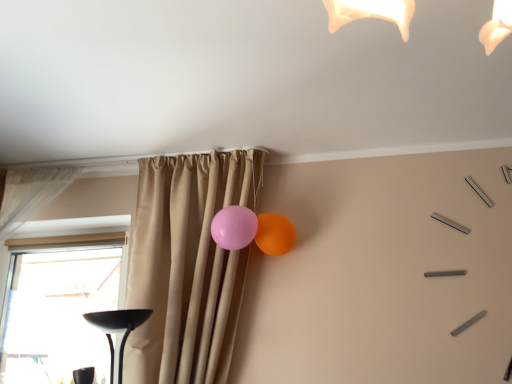
Locate an element on the screen. The image size is (512, 384). beige curtain at center, the second curtain in the left-to-right sequence is located at coordinates (x=186, y=266).

The image size is (512, 384). Describe the element at coordinates (31, 194) in the screenshot. I see `white sheer curtain at left, arranged as the 2th curtain when viewed from the right` at that location.

Describe the element at coordinates (234, 227) in the screenshot. This screenshot has width=512, height=384. I see `pink rubber balloon at center, the 2th balloon positioned from the right` at that location.

Locate an element on the screen. beige curtain at center, the second curtain in the left-to-right sequence is located at coordinates (186, 266).

Considering the relative sizes of transparent glass window at lower left and matte rubber balloon at upper right, which appears as the 2th balloon when viewed from the left, in the image provided, is transparent glass window at lower left bigger than matte rubber balloon at upper right, which appears as the 2th balloon when viewed from the left,?

Correct, transparent glass window at lower left is larger in size than matte rubber balloon at upper right, which appears as the 2th balloon when viewed from the left.

Is transparent glass window at lower left spatially inside matte rubber balloon at upper right, which appears as the 2th balloon when viewed from the left, or outside of it?

transparent glass window at lower left is located beyond the bounds of matte rubber balloon at upper right, which appears as the 2th balloon when viewed from the left.

From the image's perspective, relative to matte rubber balloon at upper right, positioned as the 1th balloon in right-to-left order, is transparent glass window at lower left above or below?

Based on their image positions, transparent glass window at lower left is located beneath matte rubber balloon at upper right, positioned as the 1th balloon in right-to-left order.

Can you confirm if transparent glass window at lower left is wider than matte rubber balloon at upper right, positioned as the 1th balloon in right-to-left order?

No.

Considering the positions of objects beige curtain at center, the second curtain in the left-to-right sequence, and white sheer curtain at left, which is the first curtain in left-to-right order, in the image provided, who is behind, beige curtain at center, the second curtain in the left-to-right sequence, or white sheer curtain at left, which is the first curtain in left-to-right order,?

Positioned behind is white sheer curtain at left, which is the first curtain in left-to-right order.

Considering the points (186, 258) and (62, 188), which point is in front, point (186, 258) or point (62, 188)?

The point (186, 258) is closer to the camera.

Is beige curtain at center, which is the 1th curtain in right-to-left order, aimed at white sheer curtain at left, arranged as the 2th curtain when viewed from the right?

No, beige curtain at center, which is the 1th curtain in right-to-left order, is not turned towards white sheer curtain at left, arranged as the 2th curtain when viewed from the right.

Is beige curtain at center, the second curtain in the left-to-right sequence, taller or shorter than white sheer curtain at left, which is the first curtain in left-to-right order?

Considering their sizes, beige curtain at center, the second curtain in the left-to-right sequence, has more height than white sheer curtain at left, which is the first curtain in left-to-right order.

From the image's perspective, between transparent glass window at lower left and beige curtain at center, which is the 1th curtain in right-to-left order, who is located below?

transparent glass window at lower left.

Can you tell me how much transparent glass window at lower left and beige curtain at center, which is the 1th curtain in right-to-left order, differ in facing direction?

They differ by 3.63 degrees in their facing directions.

Considering the points (65, 262) and (194, 372), which point is behind, point (65, 262) or point (194, 372)?

The point (65, 262) is farther from the camera.

From the picture: Is transparent glass window at lower left facing towards beige curtain at center, which is the 1th curtain in right-to-left order?

No.

Is pink rubber balloon at center, the first balloon when ordered from left to right, looking in the opposite direction of beige curtain at center, the second curtain in the left-to-right sequence?

Yes.

Which object is thinner, pink rubber balloon at center, the first balloon when ordered from left to right, or beige curtain at center, which is the 1th curtain in right-to-left order?

With smaller width is pink rubber balloon at center, the first balloon when ordered from left to right.

At what (x,y) coordinates should I click in order to perform the action: click on the 1st balloon behind the beige curtain at center, which is the 1th curtain in right-to-left order, starting your count from the anchor. Please return your answer as a coordinate pair (x, y). This screenshot has height=384, width=512. Looking at the image, I should click on (234, 227).

From the image's perspective, who appears lower, pink rubber balloon at center, the first balloon when ordered from left to right, or beige curtain at center, which is the 1th curtain in right-to-left order?

beige curtain at center, which is the 1th curtain in right-to-left order, from the image's perspective.

From a real-world perspective, is matte rubber balloon at upper right, which appears as the 2th balloon when viewed from the left, positioned under beige curtain at center, the second curtain in the left-to-right sequence, based on gravity?

No.

Is matte rubber balloon at upper right, positioned as the 1th balloon in right-to-left order, completely or partially outside of beige curtain at center, the second curtain in the left-to-right sequence?

No, matte rubber balloon at upper right, positioned as the 1th balloon in right-to-left order, is not entirely external to beige curtain at center, the second curtain in the left-to-right sequence.

Is point (262, 224) farther from viewer compared to point (163, 180)?

No, it is in front of (163, 180).

From the picture: Is matte rubber balloon at upper right, which appears as the 2th balloon when viewed from the left, bigger than beige curtain at center, which is the 1th curtain in right-to-left order?

Actually, matte rubber balloon at upper right, which appears as the 2th balloon when viewed from the left, might be smaller than beige curtain at center, which is the 1th curtain in right-to-left order.

How different are the orientations of matte rubber balloon at upper right, positioned as the 1th balloon in right-to-left order, and white sheer curtain at left, which is the first curtain in left-to-right order, in degrees?

6.57 degrees separate the facing orientations of matte rubber balloon at upper right, positioned as the 1th balloon in right-to-left order, and white sheer curtain at left, which is the first curtain in left-to-right order.

From a real-world perspective, is matte rubber balloon at upper right, which appears as the 2th balloon when viewed from the left, above or below white sheer curtain at left, which is the first curtain in left-to-right order?

In terms of real-world spatial position, matte rubber balloon at upper right, which appears as the 2th balloon when viewed from the left, is below white sheer curtain at left, which is the first curtain in left-to-right order.

This screenshot has height=384, width=512. I want to click on the 1st balloon in front when counting from the white sheer curtain at left, which is the first curtain in left-to-right order, so click(x=274, y=234).

Is matte rubber balloon at upper right, positioned as the 1th balloon in right-to-left order, positioned before white sheer curtain at left, arranged as the 2th curtain when viewed from the right?

Yes, matte rubber balloon at upper right, positioned as the 1th balloon in right-to-left order, is closer to the camera.

From the image's perspective, is transparent glass window at lower left under pink rubber balloon at center, the first balloon when ordered from left to right?

Indeed, from the image's perspective, transparent glass window at lower left is shown beneath pink rubber balloon at center, the first balloon when ordered from left to right.

Is transparent glass window at lower left outside of pink rubber balloon at center, the first balloon when ordered from left to right?

transparent glass window at lower left lies outside pink rubber balloon at center, the first balloon when ordered from left to right,'s area.

Which is behind, point (74, 318) or point (242, 245)?

Positioned behind is point (74, 318).

From a real-world perspective, between transparent glass window at lower left and pink rubber balloon at center, the first balloon when ordered from left to right, who is vertically higher?

In real-world perspective, pink rubber balloon at center, the first balloon when ordered from left to right, is above.

Image resolution: width=512 pixels, height=384 pixels. I want to click on window behind the matte rubber balloon at upper right, positioned as the 1th balloon in right-to-left order, so coord(59,301).

Locate an element on the screen. The height and width of the screenshot is (384, 512). curtain above the beige curtain at center, which is the 1th curtain in right-to-left order (from the image's perspective) is located at coordinates (31, 194).

Which object lies further to the anchor point matte rubber balloon at upper right, positioned as the 1th balloon in right-to-left order, beige curtain at center, which is the 1th curtain in right-to-left order, or white sheer curtain at left, which is the first curtain in left-to-right order?

white sheer curtain at left, which is the first curtain in left-to-right order, is further to matte rubber balloon at upper right, positioned as the 1th balloon in right-to-left order.

Looking at this image, when comparing their distances from white sheer curtain at left, which is the first curtain in left-to-right order, does beige curtain at center, which is the 1th curtain in right-to-left order, or transparent glass window at lower left seem further?

beige curtain at center, which is the 1th curtain in right-to-left order, lies further to white sheer curtain at left, which is the first curtain in left-to-right order, than the other object.

From the image, which object appears to be nearer to transparent glass window at lower left, white sheer curtain at left, arranged as the 2th curtain when viewed from the right, or beige curtain at center, the second curtain in the left-to-right sequence?

white sheer curtain at left, arranged as the 2th curtain when viewed from the right, is closer to transparent glass window at lower left.

Estimate the real-world distances between objects in this image. Which object is further from transparent glass window at lower left, beige curtain at center, the second curtain in the left-to-right sequence, or pink rubber balloon at center, the first balloon when ordered from left to right?

pink rubber balloon at center, the first balloon when ordered from left to right, lies further to transparent glass window at lower left than the other object.

Looking at the image, which one is located further to matte rubber balloon at upper right, positioned as the 1th balloon in right-to-left order, white sheer curtain at left, arranged as the 2th curtain when viewed from the right, or beige curtain at center, the second curtain in the left-to-right sequence?

The object further to matte rubber balloon at upper right, positioned as the 1th balloon in right-to-left order, is white sheer curtain at left, arranged as the 2th curtain when viewed from the right.

When comparing their distances from transparent glass window at lower left, does matte rubber balloon at upper right, positioned as the 1th balloon in right-to-left order, or beige curtain at center, which is the 1th curtain in right-to-left order, seem further?

Based on the image, matte rubber balloon at upper right, positioned as the 1th balloon in right-to-left order, appears to be further to transparent glass window at lower left.

Looking at the image, which one is located further to beige curtain at center, which is the 1th curtain in right-to-left order, transparent glass window at lower left or white sheer curtain at left, arranged as the 2th curtain when viewed from the right?

transparent glass window at lower left lies further to beige curtain at center, which is the 1th curtain in right-to-left order, than the other object.

From the image, which object appears to be nearer to matte rubber balloon at upper right, which appears as the 2th balloon when viewed from the left, transparent glass window at lower left or beige curtain at center, which is the 1th curtain in right-to-left order?

beige curtain at center, which is the 1th curtain in right-to-left order, is positioned closer to the anchor matte rubber balloon at upper right, which appears as the 2th balloon when viewed from the left.

The width and height of the screenshot is (512, 384). I want to click on curtain situated between white sheer curtain at left, which is the first curtain in left-to-right order, and matte rubber balloon at upper right, positioned as the 1th balloon in right-to-left order, from left to right, so click(x=186, y=266).

I want to click on curtain between transparent glass window at lower left and pink rubber balloon at center, the 2th balloon positioned from the right, so click(186, 266).

Identify the location of window between white sheer curtain at left, which is the first curtain in left-to-right order, and matte rubber balloon at upper right, positioned as the 1th balloon in right-to-left order, in the horizontal direction. (59, 301).

You are a GUI agent. You are given a task and a screenshot of the screen. Output one action in this format:
    pyautogui.click(x=<x>, y=<y>)
    Task: Click on the window located between white sheer curtain at left, arranged as the 2th curtain when viewed from the right, and pink rubber balloon at center, the 2th balloon positioned from the right, in the left-right direction
    The height and width of the screenshot is (384, 512).
    Given the screenshot: What is the action you would take?
    pyautogui.click(x=59, y=301)